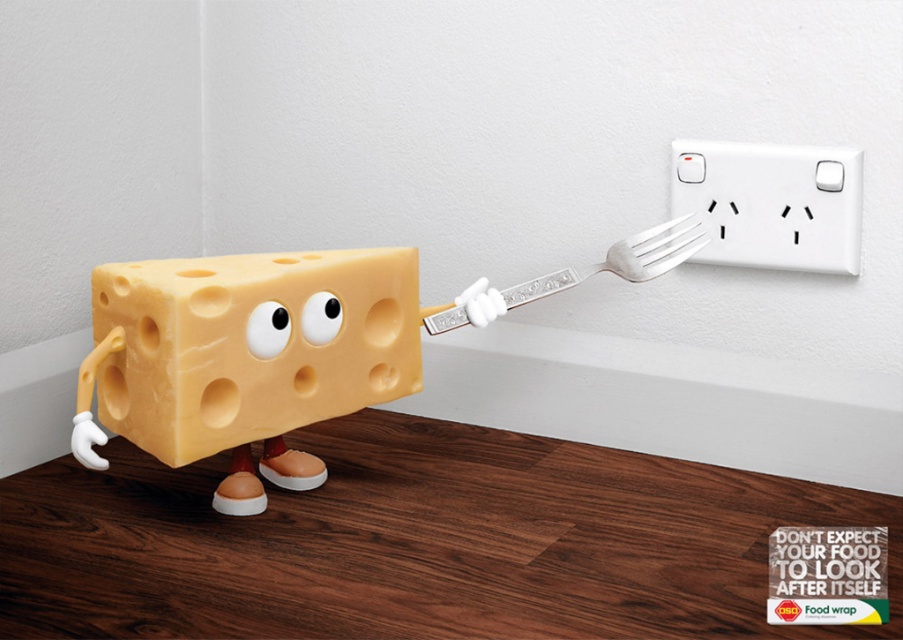
Is white plastic socket at upper right bigger than silver metallic fork at upper right?

No.

Is white plastic socket at upper right shorter than silver metallic fork at upper right?

In fact, white plastic socket at upper right may be taller than silver metallic fork at upper right.

Is point (844, 228) positioned after point (616, 264)?

No, (844, 228) is closer to viewer.

Image resolution: width=903 pixels, height=640 pixels. In order to click on white plastic socket at upper right in this screenshot , I will do `click(771, 204)`.

Is point (256, 436) more distant than point (228, 426)?

Yes, point (256, 436) is farther from viewer.

Can you confirm if yellow cheese block at center is smaller than yellow cheese at center?

Actually, yellow cheese block at center might be larger than yellow cheese at center.

Is point (264, 324) positioned after point (144, 413)?

No, (264, 324) is in front of (144, 413).

This screenshot has height=640, width=903. I want to click on yellow cheese block at center, so click(245, 358).

The image size is (903, 640). What do you see at coordinates (245, 358) in the screenshot?
I see `yellow cheese block at center` at bounding box center [245, 358].

Does point (334, 296) come in front of point (647, 248)?

That is True.

Is point (632, 252) closer to camera compared to point (657, 252)?

Yes, point (632, 252) is closer to viewer.

In order to click on yellow cheese block at center in this screenshot , I will do [x=245, y=358].